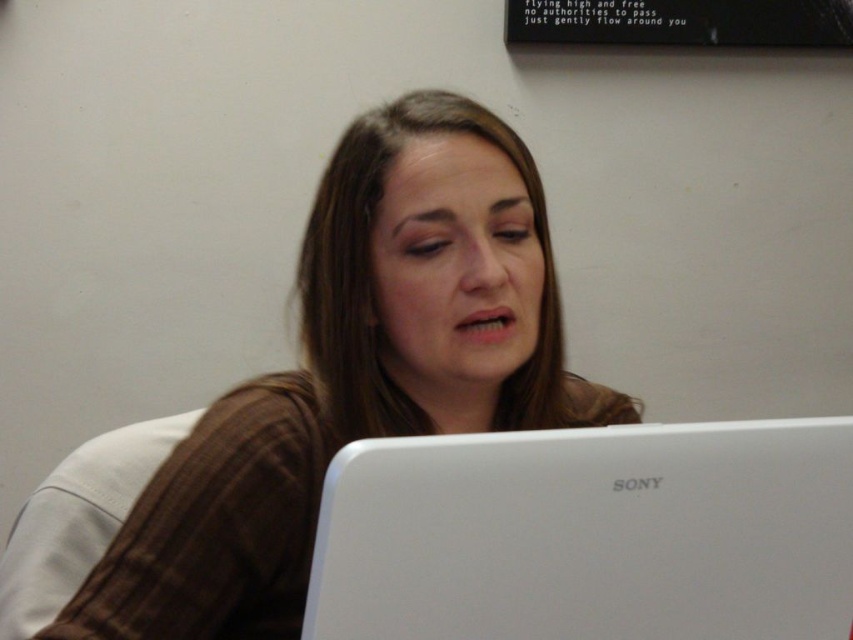
You are a fashion designer who wants to create a matching accessory for the brown textured shirt at center and the white matte laptop at lower center. Considering their sizes, which one should you design the accessory to pair with first?

The brown textured shirt at center is much taller than the white matte laptop at lower center, so you should design the accessory to pair with the brown textured shirt at center first to ensure proper proportion.

The brown textured shirt at center is located at coordinates point 0.584, 0.416. If you were to draw a vertical line through this point, which object would be to the left of this line?

The brown textured shirt at center is located at point (354, 372). Since this point is the center of the shirt, the vertical line would pass through the shirt itself, so there is no object to the left of this line as the shirt spans across it.